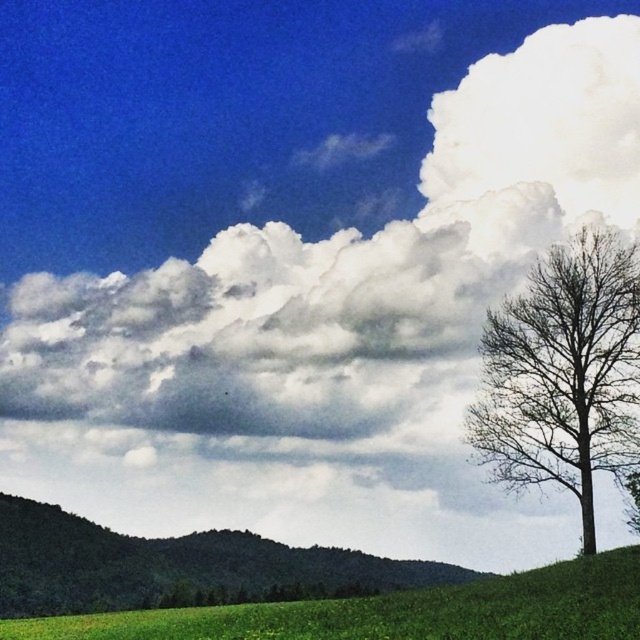
Question: Can you confirm if bare wood tree at right is thinner than green grassy hillside at lower left?

Choices:
 (A) no
 (B) yes

Answer: (B)

Question: Which point appears farthest from the camera in this image?

Choices:
 (A) (60, 552)
 (B) (598, 394)

Answer: (A)

Question: Which point appears closest to the camera in this image?

Choices:
 (A) (156, 547)
 (B) (541, 278)

Answer: (B)

Question: Is bare wood tree at right bigger than green grassy hillside at lower left?

Choices:
 (A) yes
 (B) no

Answer: (B)

Question: Is bare wood tree at right positioned in front of green grassy hillside at lower left?

Choices:
 (A) no
 (B) yes

Answer: (B)